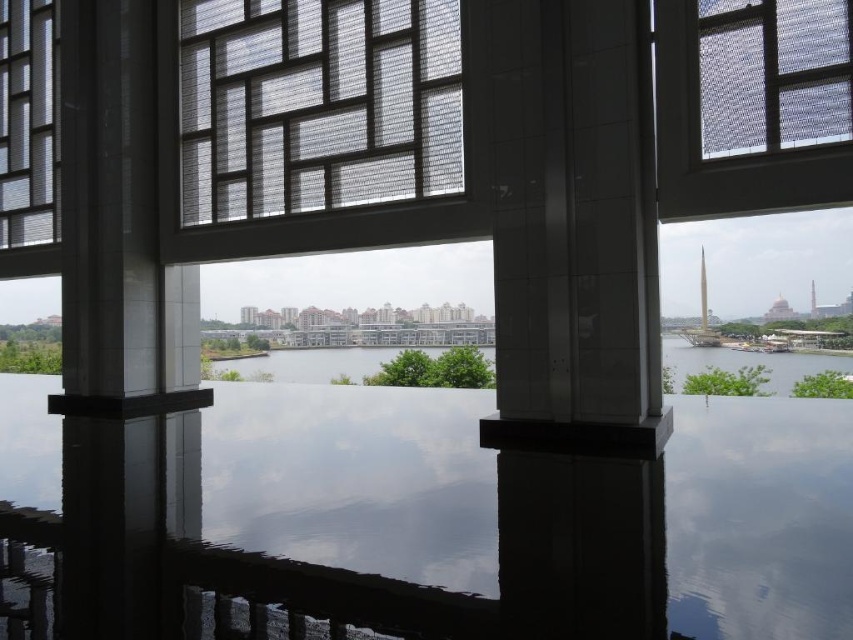
You are standing inside the modern building and looking through the large windows. There are two points marked in the scene, point (x=384, y=172) and point (x=38, y=241). Which point is closer to your eyes?

Point (x=384, y=172) is closer to the camera than point (x=38, y=241).

You are an interior designer assessing the lighting in a modern building. You notice the translucent mesh window at center and the translucent mesh screen at upper center. Which of these two objects is positioned to the left of the other?

The translucent mesh window at center is to the left of the translucent mesh screen at upper center.